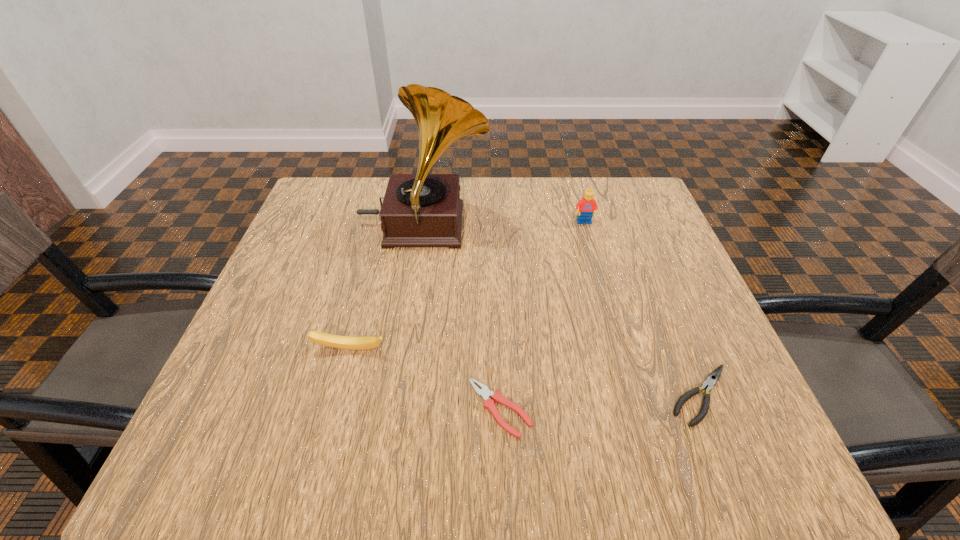
You are a GUI agent. You are given a task and a screenshot of the screen. Output one action in this format:
    pyautogui.click(x=<x>, y=<y>)
    Task: Click on the free space located at the stem of the banana
    
    Given the screenshot: What is the action you would take?
    pyautogui.click(x=324, y=446)

Identify the location of free space located 0.190m on the back of the rightmost object. The height and width of the screenshot is (540, 960). (659, 290).

The width and height of the screenshot is (960, 540). What are the coordinates of `free region located 0.370m on the back of the shortest object` in the screenshot? It's located at (494, 245).

Find the location of a particular element. Image resolution: width=960 pixels, height=540 pixels. phonograph record that is at the far edge is located at coordinates (419, 210).

Where is `Lego at the far edge`? The height and width of the screenshot is (540, 960). Lego at the far edge is located at coordinates (585, 207).

What are the coordinates of `phonograph record located at the left edge` in the screenshot? It's located at (419, 210).

Identify the location of banana positioned at the left edge. (341, 342).

Locate an element on the screen. The height and width of the screenshot is (540, 960). Lego located at the right edge is located at coordinates (585, 207).

The height and width of the screenshot is (540, 960). Identify the location of pliers at the right edge. (712, 379).

Identify the location of object that is positioned at the far left corner. The width and height of the screenshot is (960, 540). [x=419, y=210].